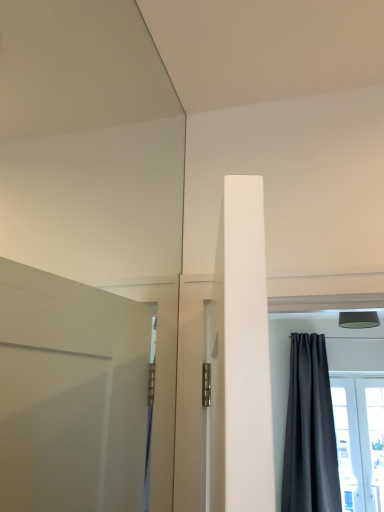
Question: Considering their positions, is dark gray matte curtain at right located in front of or behind transparent glass door at lower right?

Choices:
 (A) front
 (B) behind

Answer: (A)

Question: Would you say dark gray matte curtain at right is to the left or to the right of transparent glass door at lower right in the picture?

Choices:
 (A) right
 (B) left

Answer: (B)

Question: Considering the positions of dark gray matte curtain at right and transparent glass door at lower right in the image, is dark gray matte curtain at right taller or shorter than transparent glass door at lower right?

Choices:
 (A) tall
 (B) short

Answer: (A)

Question: From the image's perspective, is transparent glass door at lower right above or below dark gray matte curtain at right?

Choices:
 (A) above
 (B) below

Answer: (B)

Question: Is transparent glass door at lower right in front of or behind dark gray matte curtain at right in the image?

Choices:
 (A) behind
 (B) front

Answer: (A)

Question: Based on their positions, is transparent glass door at lower right located to the left or right of dark gray matte curtain at right?

Choices:
 (A) right
 (B) left

Answer: (A)

Question: In terms of width, does transparent glass door at lower right look wider or thinner when compared to dark gray matte curtain at right?

Choices:
 (A) wide
 (B) thin

Answer: (B)